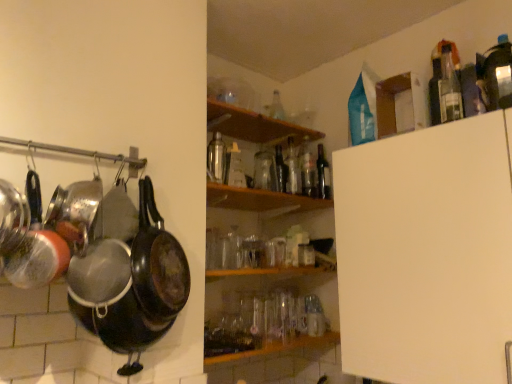
Question: Does wooden shelf at center, the 2th shelf when ordered from top to bottom, turn towards dark glass bottle at upper center, arranged as the 5th bottle when viewed from the left?

Choices:
 (A) no
 (B) yes

Answer: (A)

Question: Is wooden shelf at center, which ranks as the 1th shelf in bottom-to-top order, bigger than dark glass bottle at upper center, arranged as the 5th bottle when viewed from the left?

Choices:
 (A) no
 (B) yes

Answer: (B)

Question: Does wooden shelf at center, the 2th shelf when ordered from top to bottom, appear on the right side of dark glass bottle at upper center, arranged as the 5th bottle when viewed from the left?

Choices:
 (A) no
 (B) yes

Answer: (A)

Question: Is wooden shelf at center, the 2th shelf when ordered from top to bottom, positioned in front of dark glass bottle at upper center, which is counted as the second bottle, starting from the right?

Choices:
 (A) no
 (B) yes

Answer: (B)

Question: Does wooden shelf at center, which ranks as the 1th shelf in bottom-to-top order, appear on the left side of dark glass bottle at upper center, arranged as the 5th bottle when viewed from the left?

Choices:
 (A) no
 (B) yes

Answer: (B)

Question: Is point (132, 261) closer or farther from the camera than point (306, 145)?

Choices:
 (A) closer
 (B) farther

Answer: (A)

Question: From a real-world perspective, is black matte frying pan at left above or below clear glass bottle at center, the 5th bottle from the front?

Choices:
 (A) below
 (B) above

Answer: (A)

Question: Considering their positions, is black matte frying pan at left located in front of or behind clear glass bottle at center, positioned as the 3th bottle in right-to-left order?

Choices:
 (A) behind
 (B) front

Answer: (B)

Question: Is black matte frying pan at left bigger or smaller than clear glass bottle at center, the 5th bottle from the front?

Choices:
 (A) big
 (B) small

Answer: (A)

Question: Relative to wooden shelf at center, which ranks as the 1th shelf in bottom-to-top order, is clear glass bottle at center, positioned as the 3th bottle in right-to-left order, in front or behind?

Choices:
 (A) front
 (B) behind

Answer: (B)

Question: Based on their positions, is clear glass bottle at center, acting as the second bottle starting from the back, located to the left or right of wooden shelf at center, which ranks as the 1th shelf in bottom-to-top order?

Choices:
 (A) left
 (B) right

Answer: (B)

Question: Do you think clear glass bottle at center, the fourth bottle viewed from the left, is within wooden shelf at center, the 2th shelf when ordered from top to bottom, or outside of it?

Choices:
 (A) outside
 (B) inside

Answer: (A)

Question: Considering the positions of point (303, 185) and point (224, 206), is point (303, 185) closer or farther from the camera than point (224, 206)?

Choices:
 (A) closer
 (B) farther

Answer: (A)

Question: From the image's perspective, relative to transparent glass bottle at center, which is the fourth bottle from right to left, is wooden shelf at center, which ranks as the 1th shelf in bottom-to-top order, above or below?

Choices:
 (A) above
 (B) below

Answer: (B)

Question: Would you say wooden shelf at center, the 2th shelf when ordered from top to bottom, is to the left or to the right of transparent glass bottle at center, which ranks as the fourth bottle in front-to-back order, in the picture?

Choices:
 (A) left
 (B) right

Answer: (A)